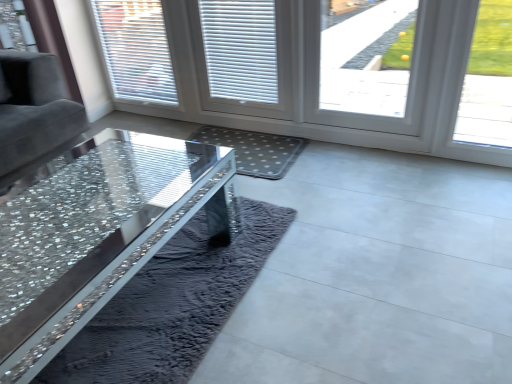
Locate an element on the screen. Image resolution: width=512 pixels, height=384 pixels. free location in front of gray dotted mat at center is located at coordinates (291, 199).